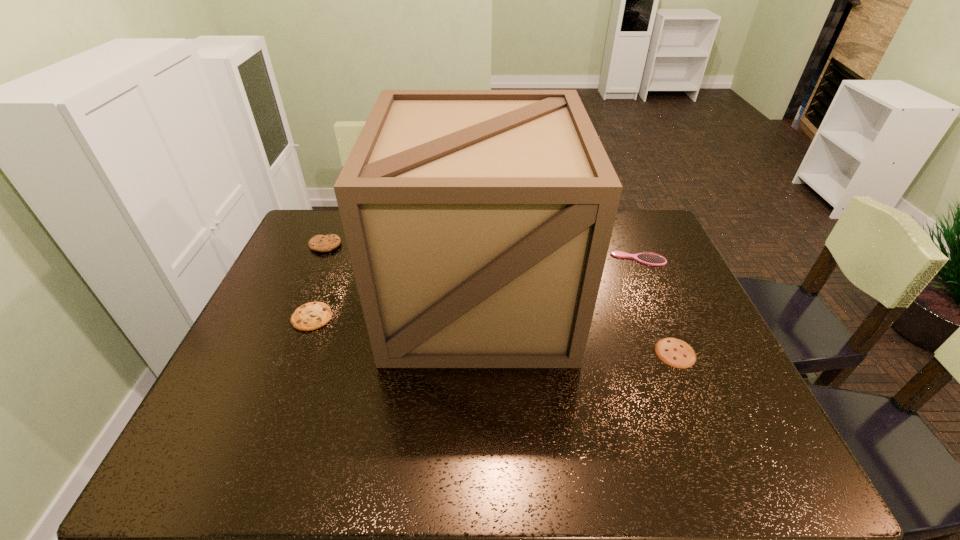
The image size is (960, 540). What are the coordinates of `free space that satisfies the following two spatial constraints: 1. on the front side of the second farthest cookie; 2. on the right side of the rightmost cookie` in the screenshot? It's located at (299, 353).

This screenshot has width=960, height=540. In order to click on vacant area that satisfies the following two spatial constraints: 1. on the back side of the second farthest cookie; 2. on the left side of the third tallest object in this screenshot , I will do `click(335, 259)`.

Identify the location of free space that satisfies the following two spatial constraints: 1. on the front side of the shortest object; 2. on the right side of the second tallest cookie. This screenshot has height=540, width=960. (299, 353).